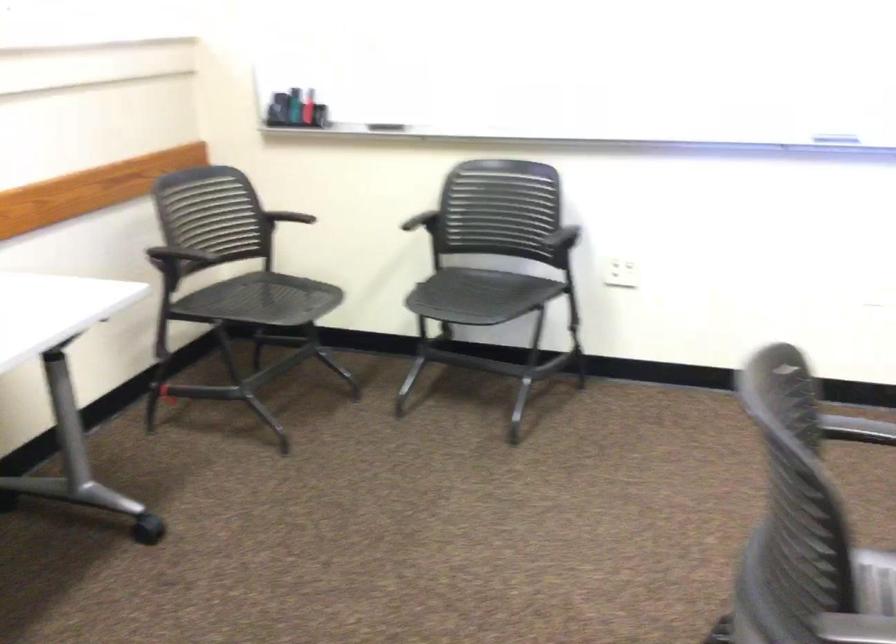
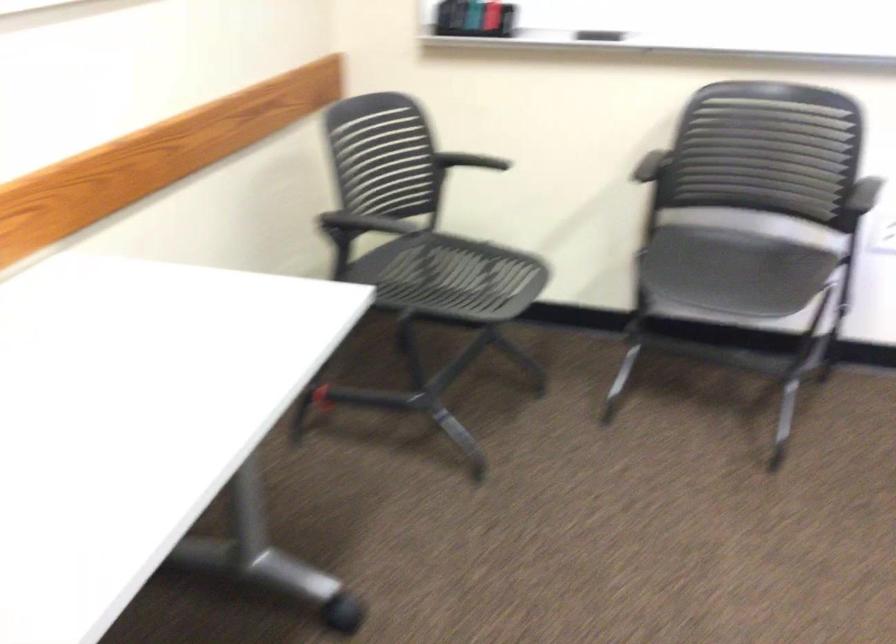
Locate, in the second image, the point that corresponds to [487,298] in the first image.

(731, 270)